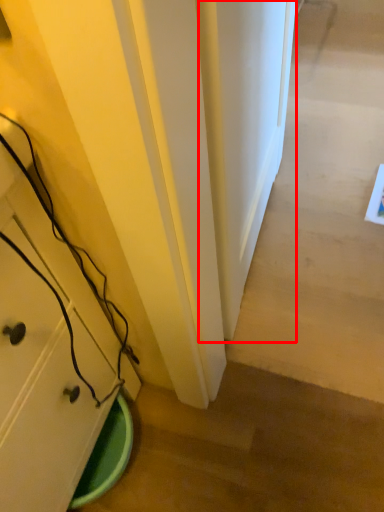
Question: From the image's perspective, where is door (annotated by the red box) located relative to cabinetry?

Choices:
 (A) below
 (B) above

Answer: (B)